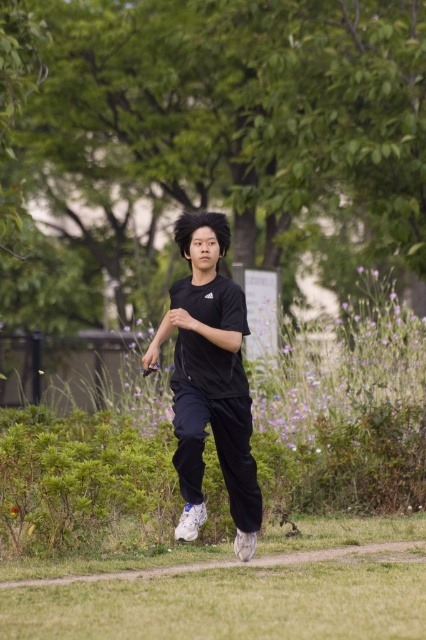
Is green grass at lower center further to the viewer compared to black matte shirt at center?

Yes, green grass at lower center is behind black matte shirt at center.

Is point (411, 605) farther from viewer compared to point (178, 524)?

No.

Between point (342, 564) and point (212, 394), which one is positioned behind?

The point (342, 564) is more distant.

What are the coordinates of `green grass at lower center` in the screenshot? It's located at (221, 598).